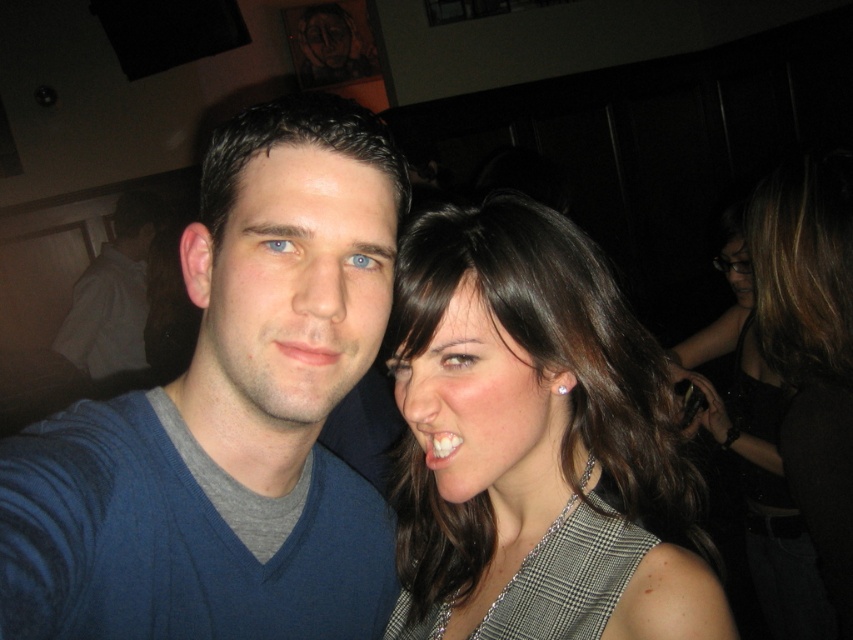
Question: Which point is closer to the camera taking this photo?

Choices:
 (A) (492, 408)
 (B) (289, 346)
 (C) (146, 204)
 (D) (804, 552)

Answer: (B)

Question: Is plaid fabric dress at right bigger than shiny black dress at right?

Choices:
 (A) yes
 (B) no

Answer: (B)

Question: Among these points, which one is nearest to the camera?

Choices:
 (A) tap(126, 193)
 (B) tap(767, 394)

Answer: (B)

Question: Estimate the real-world distances between objects in this image. Which object is farther from the matte skin at center?

Choices:
 (A) plaid fabric dress at right
 (B) blue cotton sweater at center
 (C) white glossy teeth at center
 (D) shiny black dress at right

Answer: (D)

Question: Does blue cotton shirt at left appear on the right side of white glossy teeth at center?

Choices:
 (A) yes
 (B) no

Answer: (B)

Question: Can you confirm if blue cotton shirt at left is positioned to the right of matte skin at center?

Choices:
 (A) no
 (B) yes

Answer: (A)